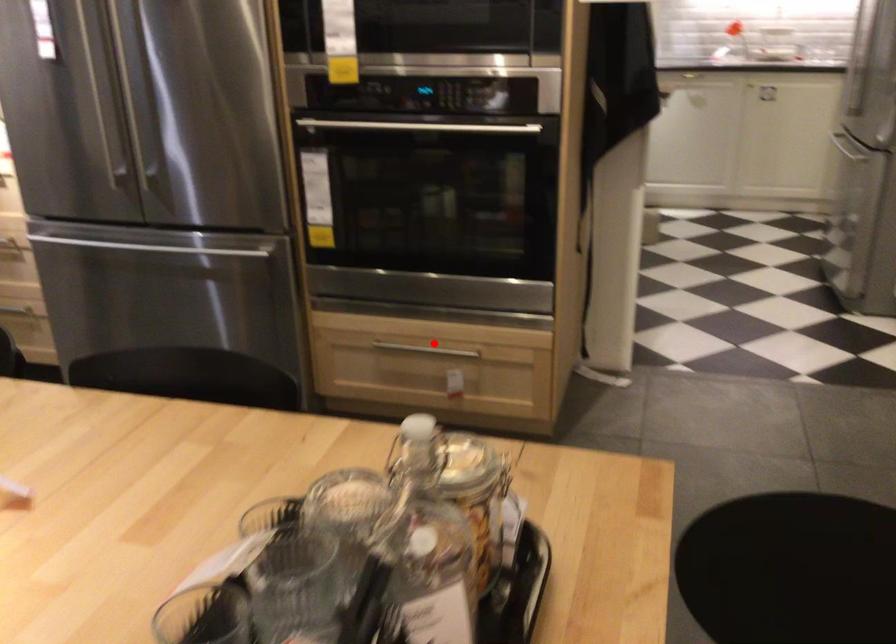
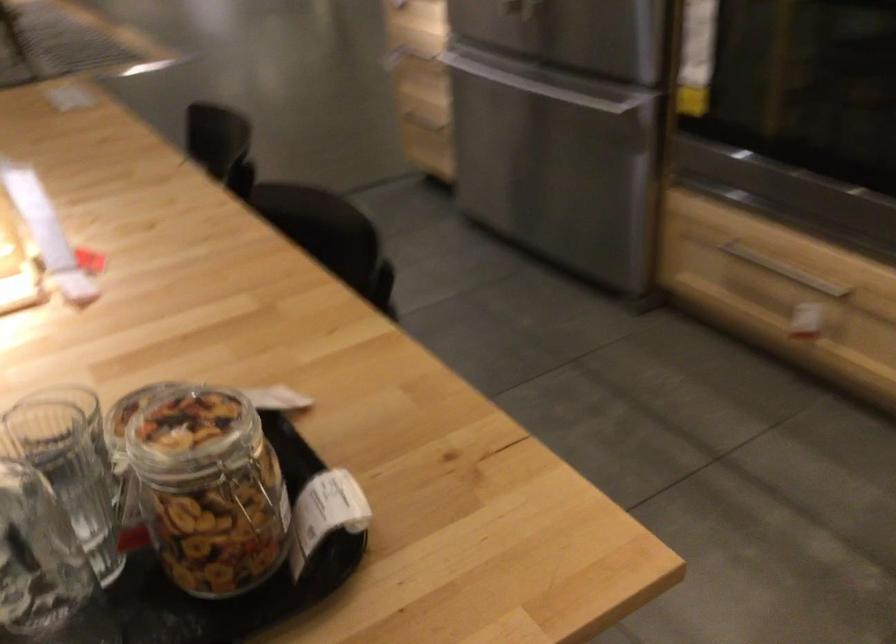
Find the pixel in the second image that matches the highlighted location in the first image.

(784, 270)